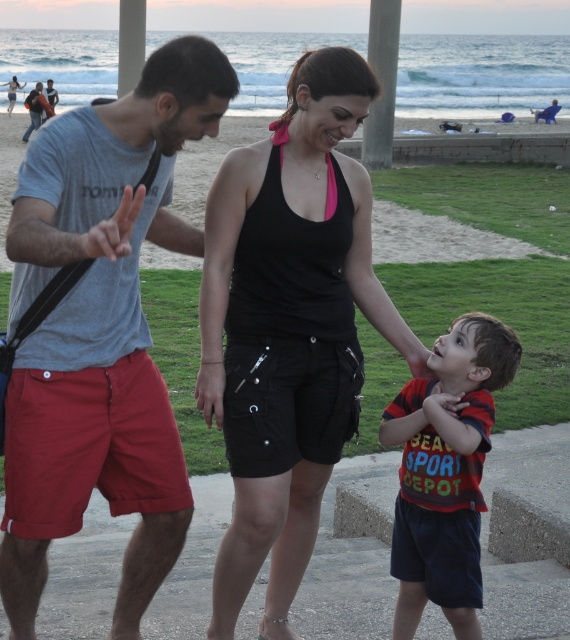
Which is in front, point (205, 70) or point (316, 266)?

Point (205, 70) is in front.

Does matte gray t-shirt at left have a lesser width compared to black cotton tank top at center?

Correct, matte gray t-shirt at left's width is less than black cotton tank top at center's.

Between point (86, 157) and point (288, 140), which one is positioned behind?

The point (288, 140) is more distant.

The width and height of the screenshot is (570, 640). In order to click on matte gray t-shirt at left in this screenshot , I will do [100, 332].

Does matte gray t-shirt at left appear over striped cotton shirt at center?

Indeed, matte gray t-shirt at left is positioned over striped cotton shirt at center.

Is matte gray t-shirt at left to the right of striped cotton shirt at center from the viewer's perspective?

No, matte gray t-shirt at left is not to the right of striped cotton shirt at center.

Is point (82, 225) farther from camera compared to point (417, 468)?

No, it is in front of (417, 468).

The height and width of the screenshot is (640, 570). What are the coordinates of `matte gray t-shirt at left` in the screenshot? It's located at (100, 332).

Who is lower down, matte gray t-shirt at left or gray concrete pavement at lower center?

gray concrete pavement at lower center

Which is more to the left, matte gray t-shirt at left or gray concrete pavement at lower center?

Positioned to the left is gray concrete pavement at lower center.

Between point (63, 476) and point (213, 556), which one is positioned behind?

The point (213, 556) is behind.

Locate an element on the screen. The image size is (570, 640). matte gray t-shirt at left is located at coordinates click(100, 332).